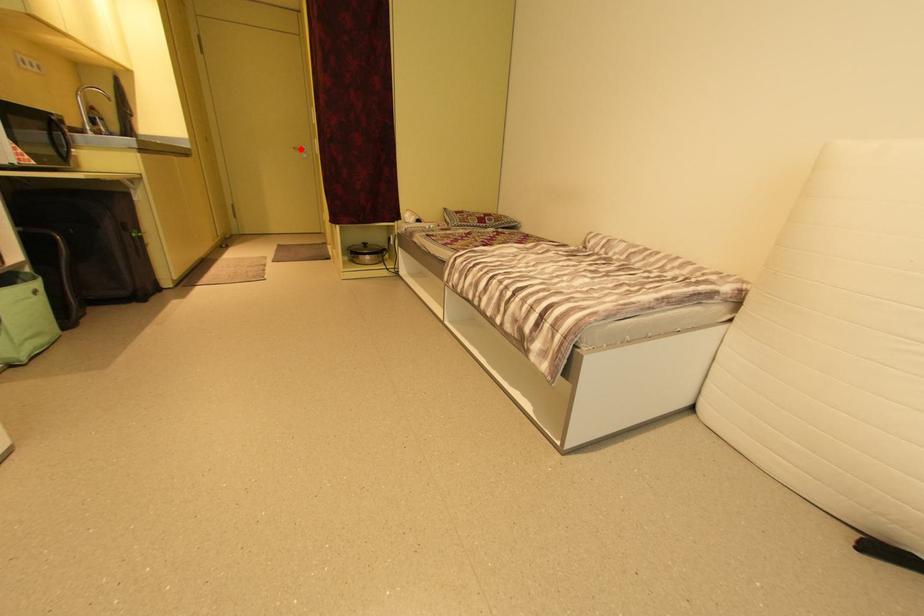
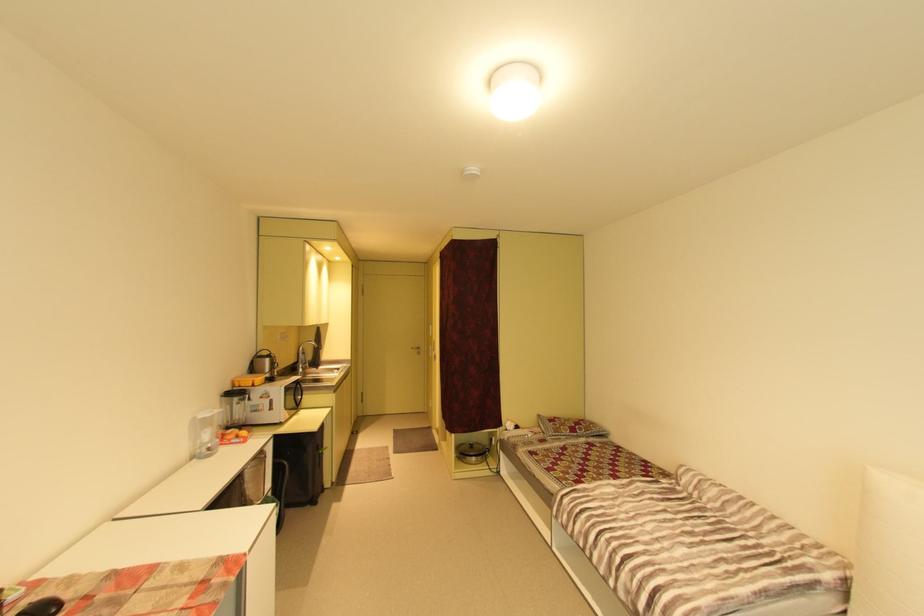
Locate, in the second image, the point that corresponds to the highlighted location in the first image.

(419, 349)